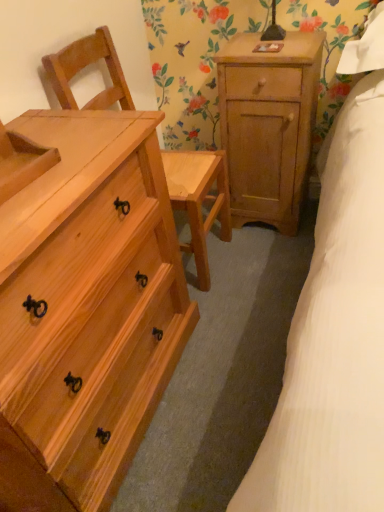
This screenshot has height=512, width=384. Describe the element at coordinates (199, 202) in the screenshot. I see `natural wood chair at left` at that location.

Describe the element at coordinates (268, 125) in the screenshot. I see `natural wood nightstand at upper right` at that location.

In the scene shown: Measure the distance between point (166,287) and camera.

4.50 feet.

The width and height of the screenshot is (384, 512). Find the location of `natural wood chest of drawers at left`. natural wood chest of drawers at left is located at coordinates (83, 304).

Image resolution: width=384 pixels, height=512 pixels. In order to click on natural wood chair at left in this screenshot , I will do `click(199, 202)`.

Does natural wood chair at left turn towards natural wood nightstand at upper right?

No, natural wood chair at left is not aimed at natural wood nightstand at upper right.

Between natural wood chair at left and natural wood nightstand at upper right, which one has more height?

With more height is natural wood chair at left.

Consider the image. Considering the positions of objects natural wood chair at left and natural wood nightstand at upper right in the image provided, who is behind, natural wood chair at left or natural wood nightstand at upper right?

natural wood nightstand at upper right is further away from the camera.

Is natural wood chest of drawers at left positioned behind natural wood chair at left?

No, it is in front of natural wood chair at left.

From the image's perspective, is natural wood chest of drawers at left located above natural wood chair at left?

No, from the image's perspective, natural wood chest of drawers at left is not over natural wood chair at left.

In the image, is natural wood chest of drawers at left on the left side or the right side of natural wood chair at left?

From the image, it's evident that natural wood chest of drawers at left is to the left of natural wood chair at left.

In terms of width, does natural wood chest of drawers at left look wider or thinner when compared to natural wood chair at left?

Clearly, natural wood chest of drawers at left has more width compared to natural wood chair at left.

Considering the relative positions of natural wood chair at left and natural wood chest of drawers at left in the image provided, is natural wood chair at left to the left or to the right of natural wood chest of drawers at left?

In the image, natural wood chair at left appears on the right side of natural wood chest of drawers at left.

From a real-world perspective, is natural wood chair at left on top of natural wood chest of drawers at left?

Yes.

Can you confirm if natural wood chair at left is taller than natural wood chest of drawers at left?

Yes.

Between point (171, 190) and point (7, 204), which one is positioned in front?

The point (7, 204) is more forward.

Is natural wood nightstand at upper right facing away from natural wood chest of drawers at left?

No, natural wood chest of drawers at left is not at the back of natural wood nightstand at upper right.

Identify the location of nightstand on the right of natural wood chest of drawers at left. (268, 125).

Is natural wood nightstand at upper right located outside natural wood chest of drawers at left?

Yes.

Is natural wood chest of drawers at left further to camera compared to natural wood nightstand at upper right?

No, it is not.

Is there a large distance between natural wood chest of drawers at left and natural wood nightstand at upper right?

No.

Can you confirm if natural wood chest of drawers at left is bigger than natural wood nightstand at upper right?

Indeed, natural wood chest of drawers at left has a larger size compared to natural wood nightstand at upper right.

From a real-world perspective, is natural wood nightstand at upper right on top of natural wood chair at left?

Incorrect, from a real-world perspective, natural wood nightstand at upper right is lower than natural wood chair at left.

Is natural wood nightstand at upper right facing towards natural wood chair at left?

No.

From the image's perspective, which one is positioned lower, natural wood nightstand at upper right or natural wood chair at left?

natural wood chair at left, from the image's perspective.

Where is `armchair below the natural wood nightstand at upper right (from the image's perspective)`? This screenshot has width=384, height=512. armchair below the natural wood nightstand at upper right (from the image's perspective) is located at coordinates (199, 202).

Locate an element on the screen. armchair above the natural wood chest of drawers at left (from a real-world perspective) is located at coordinates (199, 202).

Based on their spatial positions, is natural wood chest of drawers at left or natural wood nightstand at upper right closer to natural wood chair at left?

The object closer to natural wood chair at left is natural wood nightstand at upper right.

From the image, which object appears to be farther from natural wood chair at left, natural wood nightstand at upper right or natural wood chest of drawers at left?

Based on the image, natural wood chest of drawers at left appears to be further to natural wood chair at left.

Looking at the image, which one is located closer to natural wood nightstand at upper right, natural wood chest of drawers at left or natural wood chair at left?

natural wood chair at left is positioned closer to the anchor natural wood nightstand at upper right.

When comparing their distances from natural wood chest of drawers at left, does natural wood nightstand at upper right or natural wood chair at left seem further?

natural wood nightstand at upper right is further to natural wood chest of drawers at left.

Estimate the real-world distances between objects in this image. Which object is further from natural wood nightstand at upper right, natural wood chair at left or natural wood chest of drawers at left?

natural wood chest of drawers at left.

Considering their positions, is natural wood chair at left positioned closer to natural wood chest of drawers at left than natural wood nightstand at upper right?

natural wood chair at left lies closer to natural wood chest of drawers at left than the other object.

Find the location of a particular element. Image resolution: width=384 pixels, height=512 pixels. armchair between natural wood chest of drawers at left and natural wood nightstand at upper right in the front-back direction is located at coordinates (199, 202).